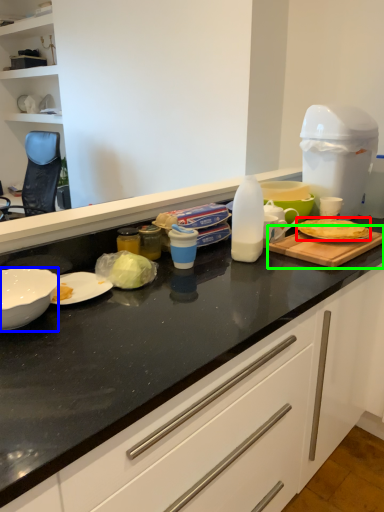
Question: Which object is positioned closest to food (highlighted by a red box)? Select from kitchen appliance (highlighted by a blue box) and cutting board (highlighted by a green box).

Choices:
 (A) kitchen appliance
 (B) cutting board

Answer: (B)